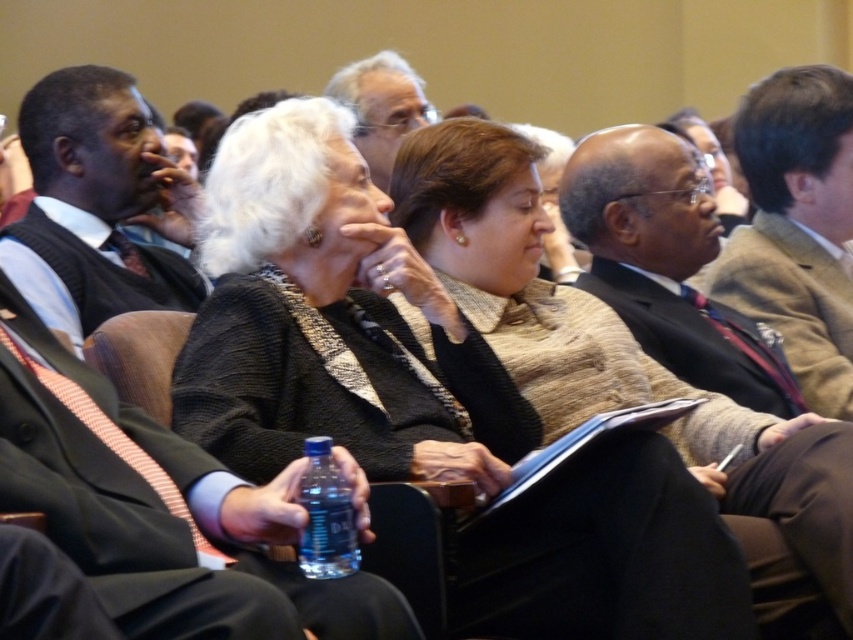
You are organizing a presentation and need to place a 15 cm tall decorative vase on the table. The brown wool suit at upper right and the blue plastic bottle at center are already on the table. Which object should you place the vase next to so it doesn

The brown wool suit at upper right has a greater height compared to the blue plastic bottle at center, so placing the vase next to the blue plastic bottle at center would provide a stable surface since the vase is shorter than the suit but similar in height to the bottle.

You are standing at the center of the auditorium and need to locate the brown wool suit at upper right. According to the coordinates provided, in which direction should you look to find it?

The brown wool suit at upper right is located at coordinates point (798, 227), so you should look to the upper right direction to find it.